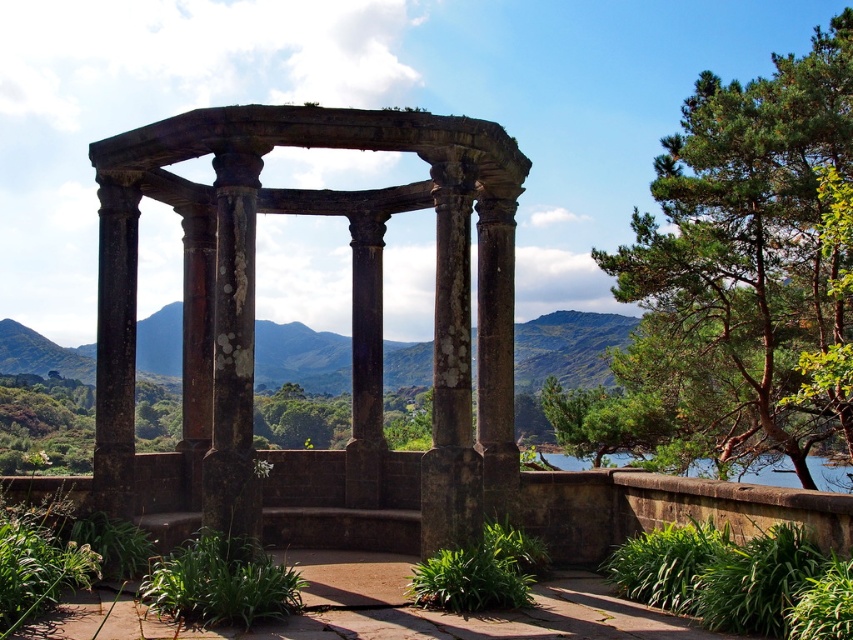
Which is behind, point (656, 413) or point (769, 476)?

The point (769, 476) is more distant.

Who is taller, green textured tree at upper right or blue stone lake at lower right?

green textured tree at upper right is taller.

At what (x,y) coordinates should I click in order to perform the action: click on green textured tree at upper right. Please return your answer as a coordinate pair (x, y). This screenshot has height=640, width=853. Looking at the image, I should click on (735, 280).

Can you confirm if dark brown stone gazebo at center is thinner than green textured tree at upper right?

Yes, dark brown stone gazebo at center is thinner than green textured tree at upper right.

Is dark brown stone gazebo at center to the right of green textured tree at upper right from the viewer's perspective?

No, dark brown stone gazebo at center is not to the right of green textured tree at upper right.

Between point (247, 140) and point (851, 426), which one is positioned behind?

Point (851, 426)

Locate an element on the screen. The height and width of the screenshot is (640, 853). dark brown stone gazebo at center is located at coordinates (351, 310).

Between point (450, 502) and point (614, 458), which one is positioned in front?

Point (450, 502)

Is dark brown stone gazebo at center above blue stone lake at lower right?

Correct, dark brown stone gazebo at center is located above blue stone lake at lower right.

Between point (457, 353) and point (827, 474), which one is positioned behind?

Point (827, 474)

Where is `dark brown stone gazebo at center`? dark brown stone gazebo at center is located at coordinates click(x=351, y=310).